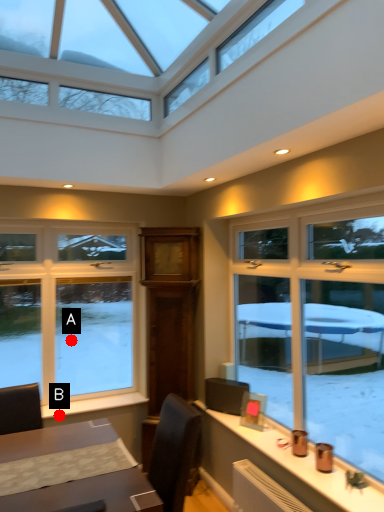
Question: Two points are circled on the image, labeled by A and B beside each circle. Among these points, which one is farthest from the camera?

Choices:
 (A) A is further
 (B) B is further

Answer: (A)